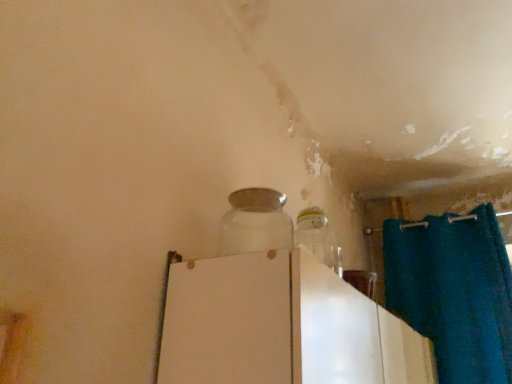
Question: In terms of size, does white glossy refrigerator at center appear bigger or smaller than transparent glass jar at center?

Choices:
 (A) small
 (B) big

Answer: (B)

Question: Would you say white glossy refrigerator at center is to the left or to the right of transparent glass jar at center in the picture?

Choices:
 (A) right
 (B) left

Answer: (A)

Question: Is white glossy refrigerator at center wider or thinner than transparent glass jar at center?

Choices:
 (A) thin
 (B) wide

Answer: (B)

Question: Is point (232, 230) positioned closer to the camera than point (240, 276)?

Choices:
 (A) farther
 (B) closer

Answer: (A)

Question: In terms of size, does transparent glass jar at center appear bigger or smaller than white glossy refrigerator at center?

Choices:
 (A) small
 (B) big

Answer: (A)

Question: Considering their positions, is transparent glass jar at center located in front of or behind white glossy refrigerator at center?

Choices:
 (A) front
 (B) behind

Answer: (B)

Question: Considering the positions of transparent glass jar at center and white glossy refrigerator at center in the image, is transparent glass jar at center taller or shorter than white glossy refrigerator at center?

Choices:
 (A) tall
 (B) short

Answer: (B)